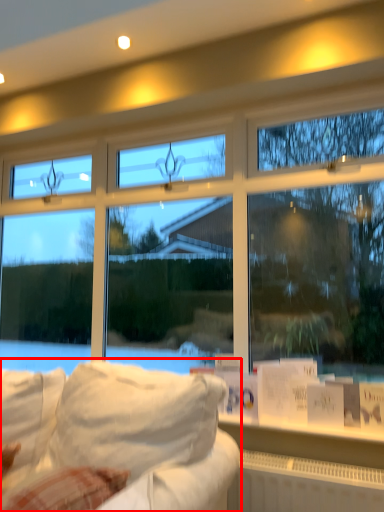
Question: Where is studio couch (annotated by the red box) located in relation to radiator in the image?

Choices:
 (A) right
 (B) left

Answer: (B)